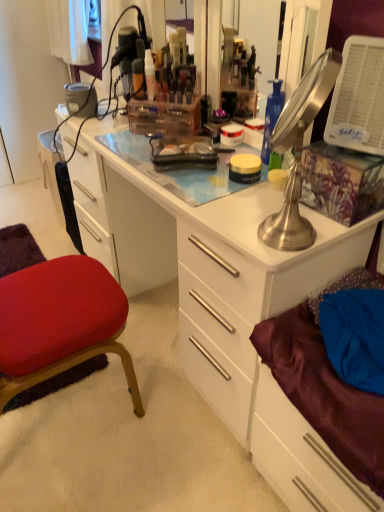
Question: From a real-world perspective, is translucent plastic container at upper center, the 1th toiletry in the right-to-left sequence, over satin purple drawer at lower right?

Choices:
 (A) no
 (B) yes

Answer: (B)

Question: Can you confirm if translucent plastic container at upper center, the 1th toiletry in the right-to-left sequence, is wider than satin purple drawer at lower right?

Choices:
 (A) yes
 (B) no

Answer: (B)

Question: From a real-world perspective, is translucent plastic container at upper center, the 1th toiletry in the right-to-left sequence, under satin purple drawer at lower right?

Choices:
 (A) yes
 (B) no

Answer: (B)

Question: Does translucent plastic container at upper center, the 2th toiletry when ordered from left to right, have a greater height compared to satin purple drawer at lower right?

Choices:
 (A) no
 (B) yes

Answer: (A)

Question: From the image's perspective, does translucent plastic container at upper center, the 1th toiletry in the right-to-left sequence, appear lower than satin purple drawer at lower right?

Choices:
 (A) yes
 (B) no

Answer: (B)

Question: Is translucent plastic container at upper center, the 2th toiletry when ordered from left to right, at the left side of satin purple drawer at lower right?

Choices:
 (A) yes
 (B) no

Answer: (A)

Question: Is metallic silver lamp at upper right wider than white glossy desk at center?

Choices:
 (A) yes
 (B) no

Answer: (B)

Question: Is white glossy desk at center at the back of metallic silver lamp at upper right?

Choices:
 (A) no
 (B) yes

Answer: (A)

Question: Is metallic silver lamp at upper right closer to camera compared to white glossy desk at center?

Choices:
 (A) yes
 (B) no

Answer: (A)

Question: From a real-world perspective, is metallic silver lamp at upper right on white glossy desk at center?

Choices:
 (A) yes
 (B) no

Answer: (A)

Question: From the image's perspective, does metallic silver lamp at upper right appear lower than white glossy desk at center?

Choices:
 (A) yes
 (B) no

Answer: (B)

Question: Can you see metallic silver lamp at upper right touching white glossy desk at center?

Choices:
 (A) yes
 (B) no

Answer: (B)

Question: Is satin purple drawer at lower right at the left side of metallic silver lamp at upper right?

Choices:
 (A) no
 (B) yes

Answer: (A)